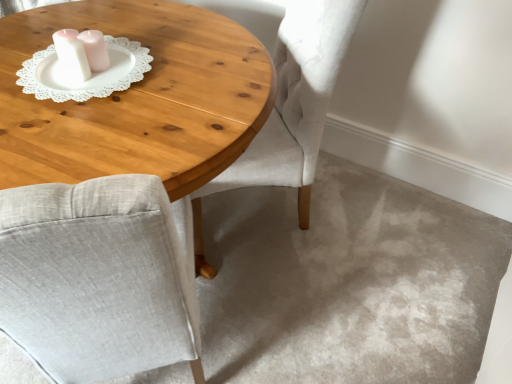
Where is `free point in front of white lace doily at upper left`? This screenshot has width=512, height=384. free point in front of white lace doily at upper left is located at coordinates 70,102.